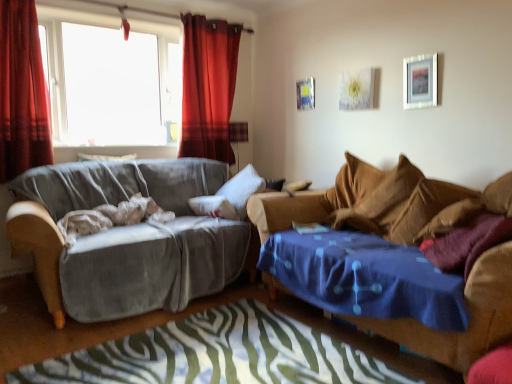
This screenshot has height=384, width=512. What do you see at coordinates (218, 354) in the screenshot?
I see `blue fabric bedcover at lower center` at bounding box center [218, 354].

Image resolution: width=512 pixels, height=384 pixels. What are the coordinates of `blue fabric bedcover at lower center` in the screenshot? It's located at (218, 354).

This screenshot has width=512, height=384. What do you see at coordinates (137, 237) in the screenshot?
I see `velvet gray couch at left, marked as the second studio couch in a right-to-left arrangement` at bounding box center [137, 237].

At what (x,y) coordinates should I click in order to perform the action: click on velvet red curtain at upper left, which ranks as the second curtain in front-to-back order. Please return your answer as a coordinate pair (x, y). Looking at the image, I should click on (208, 87).

The image size is (512, 384). What are the coordinates of `studio couch in front of the velvet gray couch at left, marked as the 1th studio couch in a left-to-right arrangement` in the screenshot? It's located at (376, 201).

Who is taller, velvet gray couch at left, marked as the 1th studio couch in a left-to-right arrangement, or velvet brown couch at right, which is the 2th studio couch from left to right?

velvet gray couch at left, marked as the 1th studio couch in a left-to-right arrangement, is taller.

Does point (233, 233) lie in front of point (384, 191)?

That is False.

Could you tell me if brown fabric pillow at right is facing velvet red curtain at upper left, the 1th curtain when ordered from right to left?

No.

Is brown fabric pillow at right inside or outside of velvet red curtain at upper left, the 2th curtain from the left?

brown fabric pillow at right lies outside velvet red curtain at upper left, the 2th curtain from the left.

Is brown fabric pillow at right closer to camera compared to velvet red curtain at upper left, which ranks as the second curtain in front-to-back order?

Yes.

From the picture: Does brown fabric pillow at right appear on the right side of velvet red curtain at upper left, which ranks as the second curtain in front-to-back order?

Yes, brown fabric pillow at right is to the right of velvet red curtain at upper left, which ranks as the second curtain in front-to-back order.

From a real-world perspective, is metallic silver picture frame at upper center, placed as the 1th picture frame when sorted from left to right, positioned above or below brown fabric pillow at right?

In terms of real-world spatial position, metallic silver picture frame at upper center, placed as the 1th picture frame when sorted from left to right, is above brown fabric pillow at right.

Is metallic silver picture frame at upper center, which is the 2th picture frame in right-to-left order, situated inside brown fabric pillow at right or outside?

metallic silver picture frame at upper center, which is the 2th picture frame in right-to-left order, is not inside brown fabric pillow at right, it's outside.

Between metallic silver picture frame at upper center, which is the 2th picture frame in right-to-left order, and brown fabric pillow at right, which one appears on the right side from the viewer's perspective?

Positioned to the right is brown fabric pillow at right.

From the picture: Considering the sizes of metallic silver picture frame at upper center, placed as the 1th picture frame when sorted from left to right, and brown fabric pillow at right in the image, is metallic silver picture frame at upper center, placed as the 1th picture frame when sorted from left to right, bigger or smaller than brown fabric pillow at right?

Clearly, metallic silver picture frame at upper center, placed as the 1th picture frame when sorted from left to right, is smaller in size than brown fabric pillow at right.

Would you say brown fabric pillow at right is inside or outside silver metallic picture frame at upper right, placed as the second picture frame when sorted from left to right?

brown fabric pillow at right is located beyond the bounds of silver metallic picture frame at upper right, placed as the second picture frame when sorted from left to right.

Is brown fabric pillow at right at the right side of silver metallic picture frame at upper right, the first picture frame from the front?

No, brown fabric pillow at right is not to the right of silver metallic picture frame at upper right, the first picture frame from the front.

Are brown fabric pillow at right and silver metallic picture frame at upper right, the first picture frame from the front, far apart?

That's not correct — brown fabric pillow at right is a little close to silver metallic picture frame at upper right, the first picture frame from the front.

Between brown fabric pillow at right and silver metallic picture frame at upper right, acting as the first picture frame starting from the right, which one has less height?

silver metallic picture frame at upper right, acting as the first picture frame starting from the right.

Is velvet red curtain at left, positioned as the second curtain in right-to-left order, completely or partially inside transparent glass window at upper left?

No, velvet red curtain at left, positioned as the second curtain in right-to-left order, is not a part of transparent glass window at upper left.

Is transparent glass window at upper left oriented away from velvet red curtain at left, which ranks as the second curtain in back-to-front order?

No.

Considering the positions of points (112, 101) and (16, 100), is point (112, 101) closer to camera compared to point (16, 100)?

No, it is not.

Is transparent glass window at upper left in contact with velvet red curtain at left, which ranks as the second curtain in back-to-front order?

There is a gap between transparent glass window at upper left and velvet red curtain at left, which ranks as the second curtain in back-to-front order.

Consider the image. From a real-world perspective, does metallic silver picture frame at upper center, the 1th picture frame in the back-to-front sequence, stand above velvet brown couch at right, which appears as the first studio couch when viewed from the right?

Yes, from a real-world perspective, metallic silver picture frame at upper center, the 1th picture frame in the back-to-front sequence, is over velvet brown couch at right, which appears as the first studio couch when viewed from the right

At what (x,y) coordinates should I click in order to perform the action: click on studio couch on the right of metallic silver picture frame at upper center, which is the second picture frame in front-to-back order. Please return your answer as a coordinate pair (x, y). Looking at the image, I should click on (376, 201).

Which point is more distant from viewer, (x=312, y=104) or (x=390, y=236)?

Positioned behind is point (x=312, y=104).

Is metallic silver picture frame at upper center, which is the 2th picture frame in right-to-left order, facing away from velvet brown couch at right, which is the 2th studio couch from left to right?

No, metallic silver picture frame at upper center, which is the 2th picture frame in right-to-left order,'s orientation is not away from velvet brown couch at right, which is the 2th studio couch from left to right.

Which of these two, blue fabric bedcover at lower center or brown fabric pillow at right, is thinner?

Thinner between the two is brown fabric pillow at right.

From a real-world perspective, is blue fabric bedcover at lower center on brown fabric pillow at right?

No.

From the image's perspective, between blue fabric bedcover at lower center and brown fabric pillow at right, which one is located above?

brown fabric pillow at right.

Is the surface of blue fabric bedcover at lower center in direct contact with brown fabric pillow at right?

blue fabric bedcover at lower center is not next to brown fabric pillow at right, and they're not touching.

This screenshot has height=384, width=512. I want to click on studio couch that appears below the velvet gray couch at left, marked as the 1th studio couch in a left-to-right arrangement (from the image's perspective), so click(376, 201).

Which curtain is the 1st one when counting from the left side of the brown fabric pillow at right? Please provide its 2D coordinates.

[(208, 87)]

Estimate the real-world distances between objects in this image. Which object is further from velvet brown couch at right, which appears as the first studio couch when viewed from the right, velvet gray couch at left, marked as the second studio couch in a right-to-left arrangement, or velvet red curtain at upper left, which appears as the 1th curtain when viewed from the back?

Among the two, velvet red curtain at upper left, which appears as the 1th curtain when viewed from the back, is located further to velvet brown couch at right, which appears as the first studio couch when viewed from the right.

Which object lies further to the anchor point velvet red curtain at upper left, which appears as the 1th curtain when viewed from the back, blue fabric bedcover at lower center or transparent glass window at upper left?

blue fabric bedcover at lower center lies further to velvet red curtain at upper left, which appears as the 1th curtain when viewed from the back, than the other object.

Looking at this image, considering their positions, is velvet brown couch at right, which appears as the first studio couch when viewed from the right, positioned closer to blue fabric bedcover at lower center than velvet red curtain at left, which ranks as the second curtain in back-to-front order?

velvet brown couch at right, which appears as the first studio couch when viewed from the right, lies closer to blue fabric bedcover at lower center than the other object.

Consider the image. Based on their spatial positions, is velvet gray couch at left, marked as the 1th studio couch in a left-to-right arrangement, or velvet red curtain at left, the first curtain from the front, further from brown fabric pillow at right?

velvet red curtain at left, the first curtain from the front, is further to brown fabric pillow at right.

In the scene shown: Considering their positions, is velvet brown couch at right, which is the 2th studio couch from left to right, positioned closer to metallic silver picture frame at upper center, which is the second picture frame in front-to-back order, than transparent glass window at upper left?

velvet brown couch at right, which is the 2th studio couch from left to right, lies closer to metallic silver picture frame at upper center, which is the second picture frame in front-to-back order, than the other object.

From the image, which object appears to be nearer to velvet gray couch at left, marked as the second studio couch in a right-to-left arrangement, brown fabric pillow at right or silver metallic picture frame at upper right, which is counted as the 2th picture frame, starting from the back?

brown fabric pillow at right.

Looking at the image, which one is located further to transparent glass window at upper left, velvet gray couch at left, marked as the 1th studio couch in a left-to-right arrangement, or blue fabric bedcover at lower center?

Based on the image, blue fabric bedcover at lower center appears to be further to transparent glass window at upper left.

From the image, which object appears to be farther from blue fabric bedcover at lower center, velvet red curtain at left, which is the 1th curtain from left to right, or brown fabric pillow at right?

The object further to blue fabric bedcover at lower center is velvet red curtain at left, which is the 1th curtain from left to right.

The image size is (512, 384). Identify the location of picture frame between blue fabric bedcover at lower center and transparent glass window at upper left from front to back. point(420,81).

This screenshot has width=512, height=384. Find the location of `picture frame located between velvet gray couch at left, marked as the 1th studio couch in a left-to-right arrangement, and silver metallic picture frame at upper right, the first picture frame from the front, in the left-right direction`. picture frame located between velvet gray couch at left, marked as the 1th studio couch in a left-to-right arrangement, and silver metallic picture frame at upper right, the first picture frame from the front, in the left-right direction is located at coordinates (305, 94).

In order to click on picture frame between velvet brown couch at right, which appears as the first studio couch when viewed from the right, and metallic silver picture frame at upper center, placed as the 1th picture frame when sorted from left to right, from front to back in this screenshot , I will do `click(420, 81)`.

The image size is (512, 384). I want to click on studio couch located between transparent glass window at upper left and velvet brown couch at right, which is the 2th studio couch from left to right, in the left-right direction, so click(137, 237).